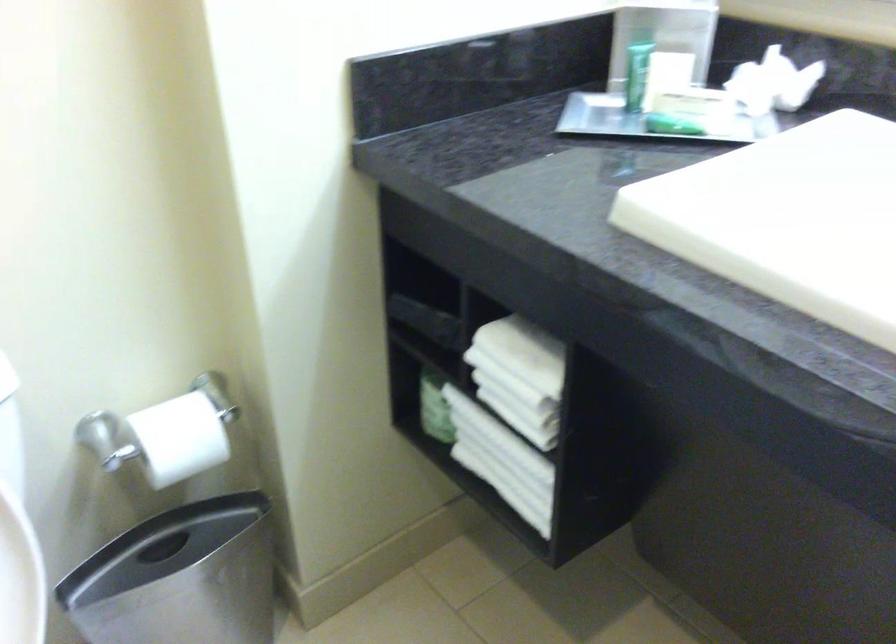
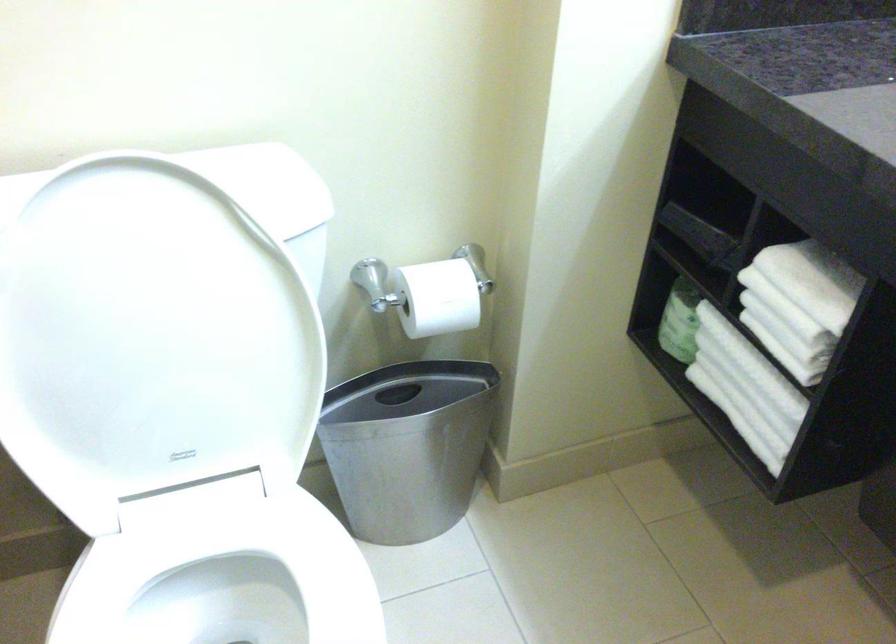
Find the pixel in the second image that matches [510,384] in the first image.

(785, 308)